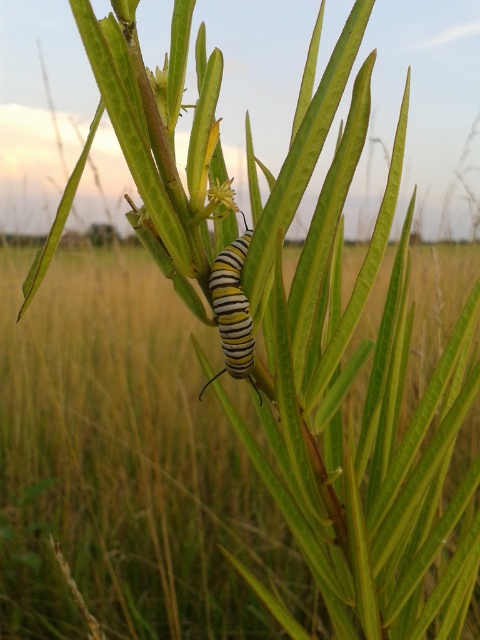
Question: Does yellow-green textured flower at upper center have a smaller size compared to green matte leaf at center?

Choices:
 (A) yes
 (B) no

Answer: (A)

Question: Estimate the real-world distances between objects in this image. Which object is farther from the yellow-green textured flower at upper center?

Choices:
 (A) green matte leaf at center
 (B) yellow striped caterpillar at center

Answer: (B)

Question: Based on their relative distances, which object is nearer to the green matte leaf at center?

Choices:
 (A) yellow-green textured flower at upper center
 (B) yellow striped caterpillar at center

Answer: (B)

Question: Can you confirm if yellow striped caterpillar at center is thinner than green matte leaf at center?

Choices:
 (A) no
 (B) yes

Answer: (A)

Question: Which of the following is the farthest from the observer?

Choices:
 (A) green matte leaf at center
 (B) yellow striped caterpillar at center

Answer: (B)

Question: Does yellow-green textured flower at upper center have a larger size compared to green matte leaf at center?

Choices:
 (A) yes
 (B) no

Answer: (B)